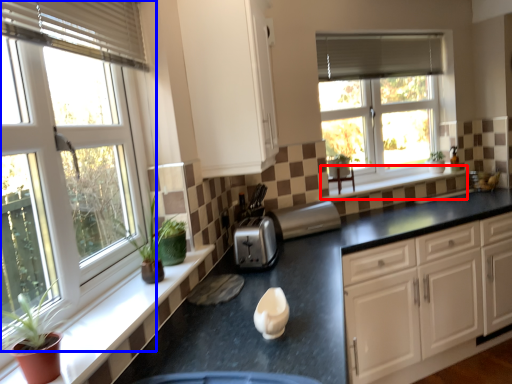
Question: Which point is closer to the camera, window sill (highlighted by a red box) or window (highlighted by a blue box)?

Choices:
 (A) window sill
 (B) window

Answer: (B)